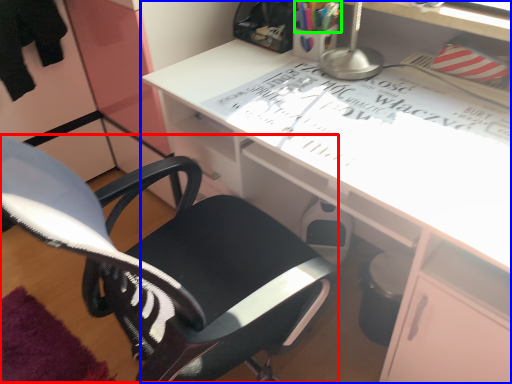
Question: Which object is positioned farthest from computer chair (highlighted by a red box)? Select from desk (highlighted by a blue box) and stationery (highlighted by a green box).

Choices:
 (A) desk
 (B) stationery

Answer: (B)